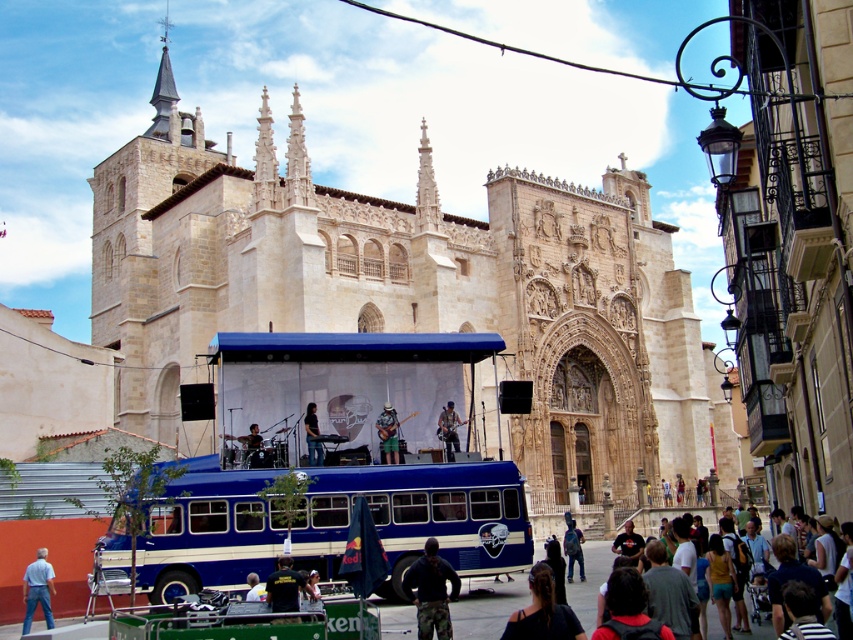
Question: Among these objects, which one is nearest to the camera?

Choices:
 (A) matte brown guitar at center
 (B) beige stone church at center

Answer: (B)

Question: Can you confirm if dark brown leather jacket at lower center is positioned to the left of matte black drum set at center?

Choices:
 (A) yes
 (B) no

Answer: (B)

Question: Among these points, which one is nearest to the camera?

Choices:
 (A) (380, 444)
 (B) (253, 464)
 (C) (432, 481)
 (D) (442, 420)

Answer: (C)

Question: Does dark brown hair at lower center appear over red backpack at center?

Choices:
 (A) no
 (B) yes

Answer: (A)

Question: Which point is closer to the camera?

Choices:
 (A) dark brown hair at lower center
 (B) light brown leather jacket at center
 (C) matte black drum set at center
 (D) light blue jeans at lower left

Answer: (A)

Question: Is red backpack at center to the right of dark blue shirt at center from the viewer's perspective?

Choices:
 (A) yes
 (B) no

Answer: (A)